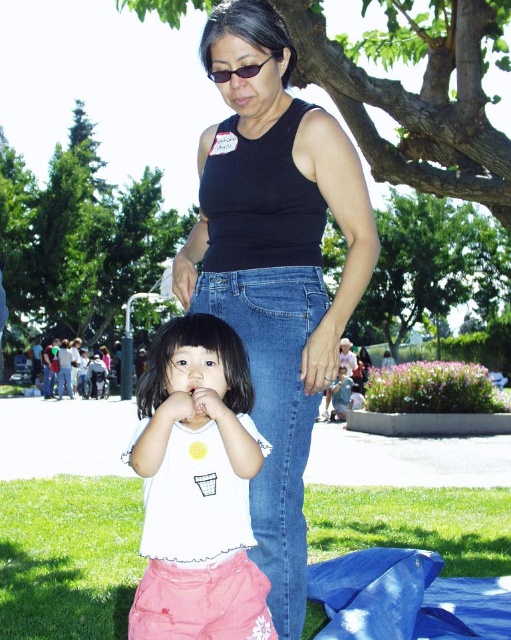
Question: Is white cotton shirt at center to the left of black plastic sunglasses at upper center from the viewer's perspective?

Choices:
 (A) yes
 (B) no

Answer: (A)

Question: Observing the image, what is the correct spatial positioning of black matte tank top at center in reference to black plastic sunglasses at upper center?

Choices:
 (A) right
 (B) left

Answer: (A)

Question: Based on their relative distances, which object is farther from the black plastic sunglasses at upper center?

Choices:
 (A) white cotton shirt at center
 (B) black matte tank top at center

Answer: (A)

Question: Is black matte tank top at center bigger than white cotton shirt at center?

Choices:
 (A) yes
 (B) no

Answer: (A)

Question: Which point is farther to the camera?

Choices:
 (A) (218, 77)
 (B) (278, 385)

Answer: (B)

Question: Which object is farther from the camera taking this photo?

Choices:
 (A) black plastic sunglasses at upper center
 (B) black matte tank top at center

Answer: (A)